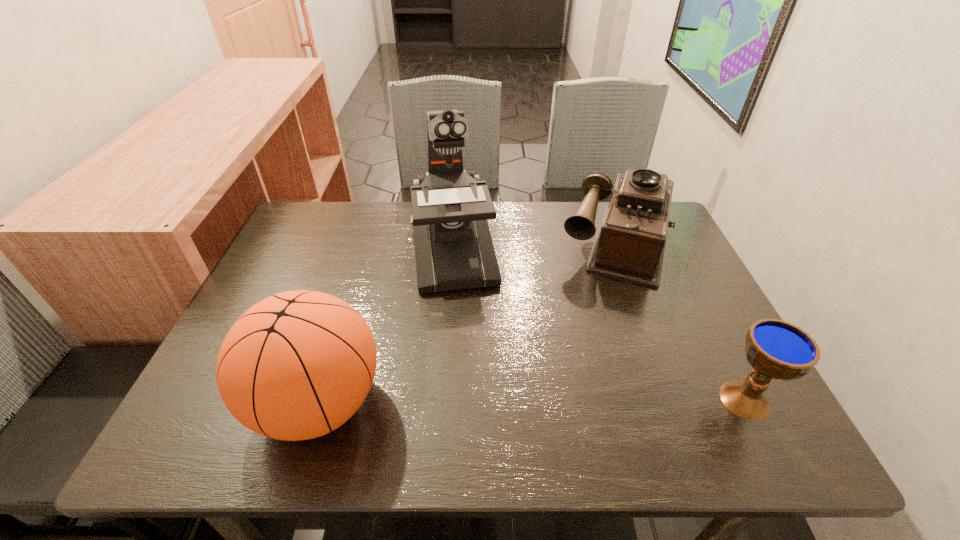
I want to click on object at the far right corner, so click(x=630, y=242).

The height and width of the screenshot is (540, 960). I want to click on object positioned at the near right corner, so click(776, 349).

Where is `vacant space at the far edge of the desktop`? This screenshot has width=960, height=540. vacant space at the far edge of the desktop is located at coordinates (560, 240).

This screenshot has width=960, height=540. I want to click on free point at the near edge, so click(x=410, y=380).

This screenshot has height=540, width=960. Find the location of `vacant area at the right edge of the desktop`. vacant area at the right edge of the desktop is located at coordinates (708, 323).

You are a GUI agent. You are given a task and a screenshot of the screen. Output one action in this format:
    pyautogui.click(x=<x>, y=<y>)
    Task: Click on the blank space at the far left corner of the desktop
    Image resolution: width=960 pixels, height=540 pixels.
    Given the screenshot: What is the action you would take?
    pyautogui.click(x=312, y=227)

Find the location of `free space between the third shortest object and the phonograph_record`. free space between the third shortest object and the phonograph_record is located at coordinates (468, 322).

The height and width of the screenshot is (540, 960). Identify the location of vacant region between the phonograph_record and the tallest object. (536, 246).

I want to click on vacant space in between the phonograph_record and the basketball, so click(468, 322).

The width and height of the screenshot is (960, 540). I want to click on unoccupied position between the chalice and the tallest object, so click(599, 325).